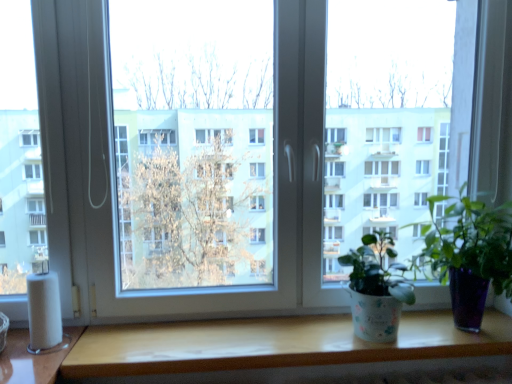
The image size is (512, 384). I want to click on vacant region under green glossy plant at center, positioned as the 1th houseplant in right-to-left order (from a real-world perspective), so click(465, 331).